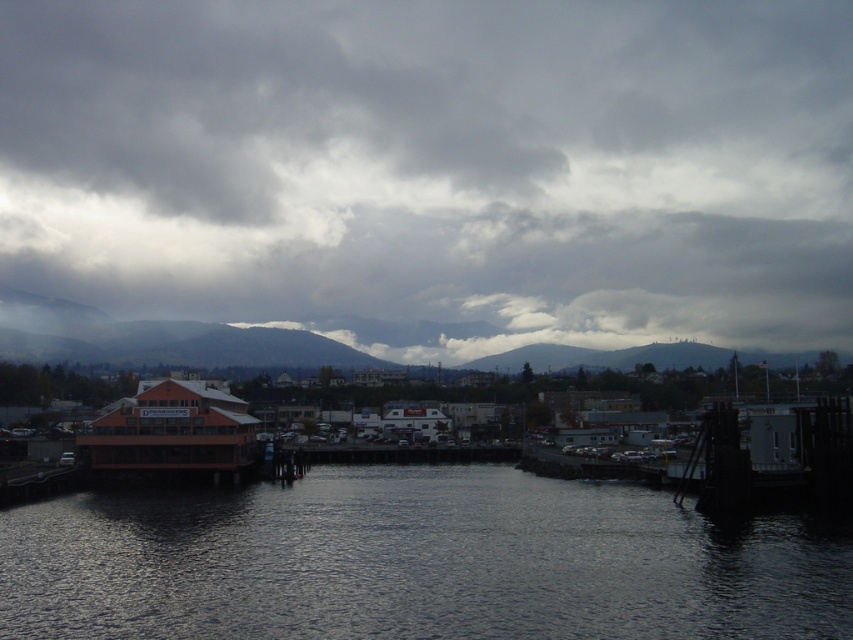
Is cloudy gray sky at upper center below dark reflective water at center?

No.

What are the coordinates of `cloudy gray sky at upper center` in the screenshot? It's located at (436, 168).

Is point (509, 76) behind point (204, 586)?

That is True.

Find the location of `cloudy gray sky at upper center`. cloudy gray sky at upper center is located at coordinates (436, 168).